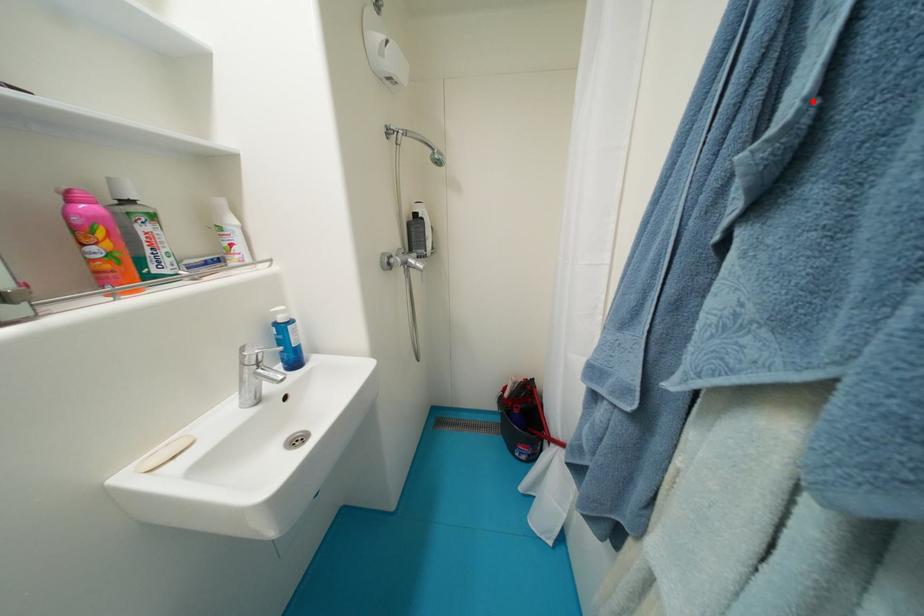
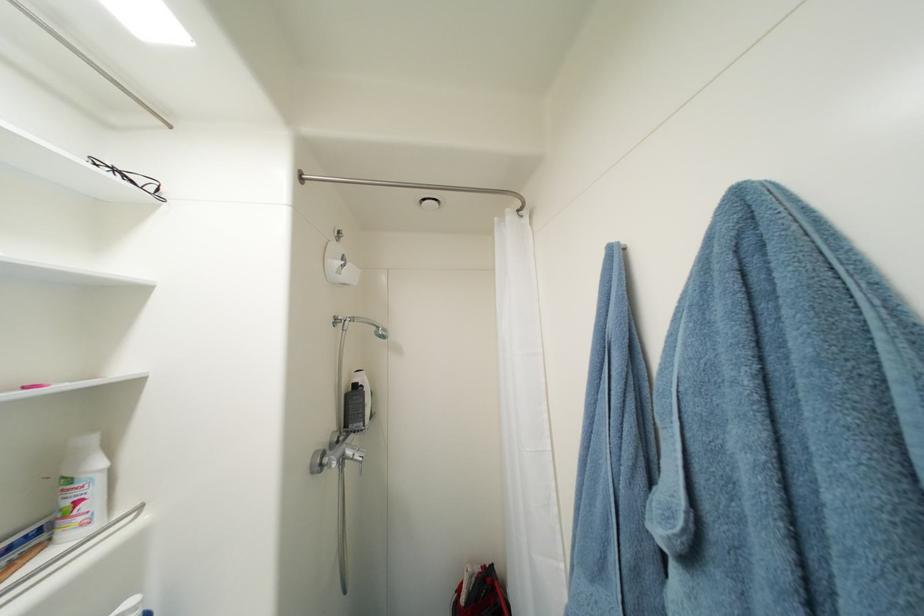
Where in the second image is the point corresponding to the highlighted location from the first image?

(691, 515)